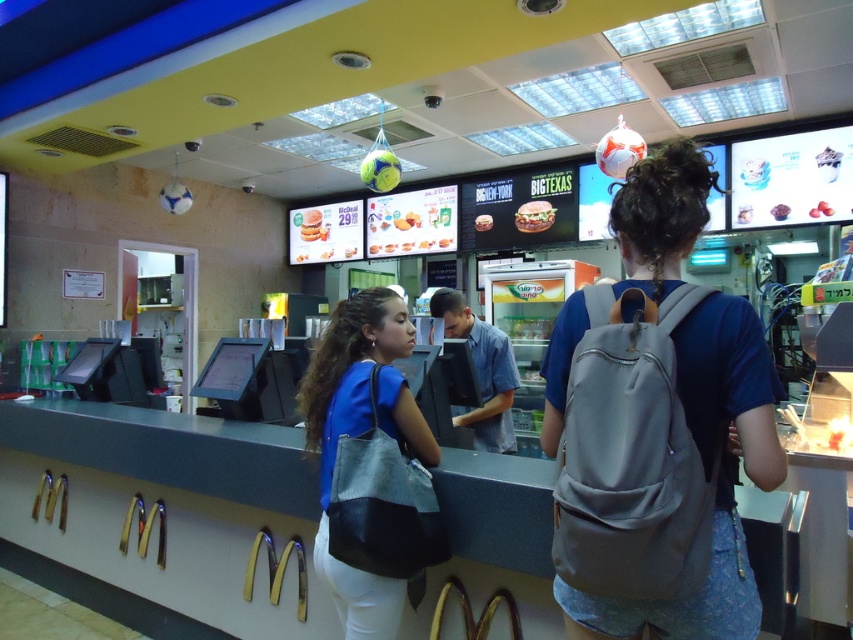
Describe the element at coordinates (729, 394) in the screenshot. I see `gray fabric backpack at center` at that location.

Identify the location of gray fabric backpack at center. The height and width of the screenshot is (640, 853). (729, 394).